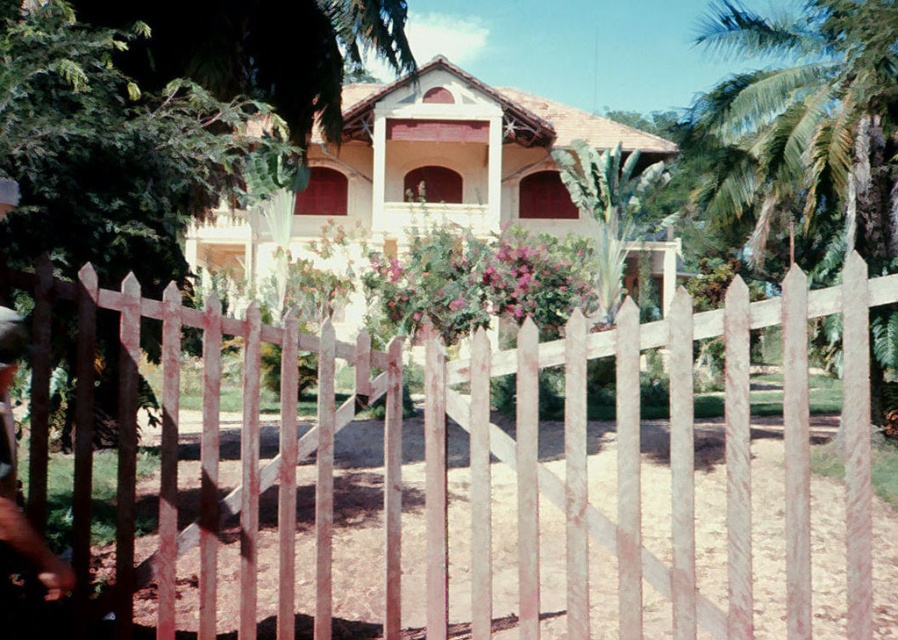
You are standing in front of the house and want to take a photo of the entire house without any obstructions. Given the white wooden picket fence at center is located at coordinates point 0.720, 0.746, should you move left or right to avoid the fence?

Since the white wooden picket fence at center is positioned at point [668,460], moving to the left would allow you to capture the entire house without obstruction from the fence.